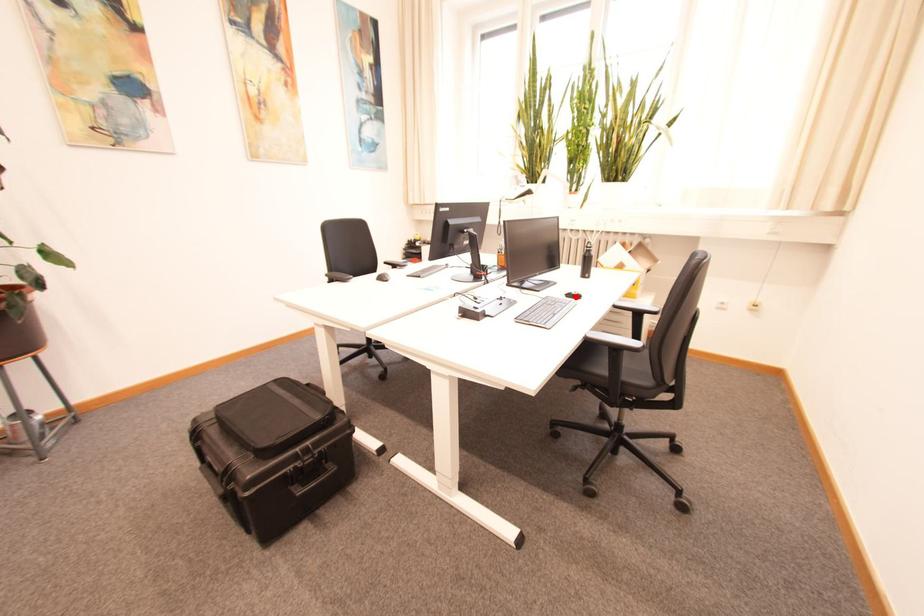
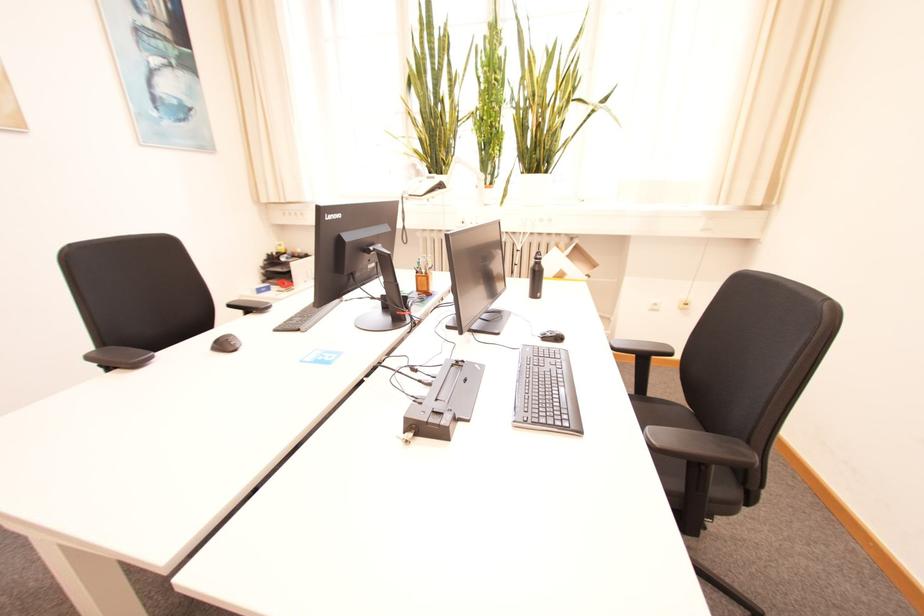
Find the pixel in the second image that matches the highlighted location in the first image.

(551, 338)